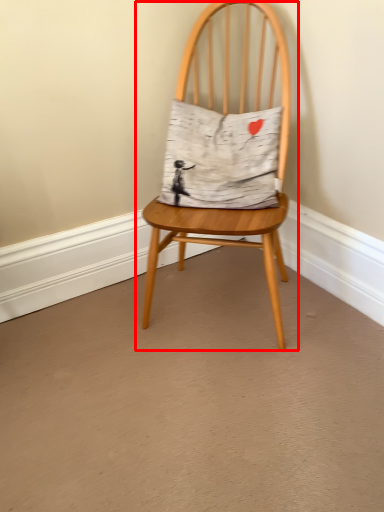
Question: From the image's perspective, considering the relative positions of chair (annotated by the red box) and pillow in the image provided, where is chair (annotated by the red box) located with respect to the staircase?

Choices:
 (A) below
 (B) above

Answer: (A)